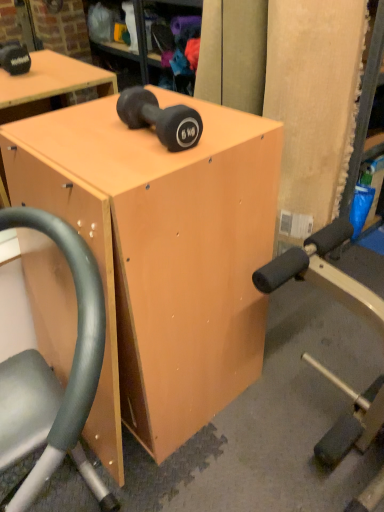
Question: Should I look upward or downward to see matte wood table at center?

Choices:
 (A) up
 (B) down

Answer: (B)

Question: From a real-world perspective, is matte black dumbbell at center physically above matte wood table at center?

Choices:
 (A) yes
 (B) no

Answer: (A)

Question: Considering the relative sizes of matte black dumbbell at center and matte wood table at center in the image provided, is matte black dumbbell at center wider than matte wood table at center?

Choices:
 (A) no
 (B) yes

Answer: (A)

Question: From the image's perspective, is matte black dumbbell at center below matte wood table at center?

Choices:
 (A) yes
 (B) no

Answer: (B)

Question: From the image's perspective, is matte black dumbbell at center on matte wood table at center?

Choices:
 (A) no
 (B) yes

Answer: (B)

Question: Considering the relative sizes of matte black dumbbell at center and matte wood table at center in the image provided, is matte black dumbbell at center smaller than matte wood table at center?

Choices:
 (A) yes
 (B) no

Answer: (A)

Question: Is matte black dumbbell at center to the left of matte wood table at center from the viewer's perspective?

Choices:
 (A) no
 (B) yes

Answer: (A)

Question: Is matte wood table at center closer to camera compared to matte black dumbbell at center?

Choices:
 (A) yes
 (B) no

Answer: (A)

Question: Is matte wood table at center outside matte black dumbbell at center?

Choices:
 (A) yes
 (B) no

Answer: (A)

Question: Considering the relative positions of matte wood table at center and matte black dumbbell at center in the image provided, is matte wood table at center to the right of matte black dumbbell at center from the viewer's perspective?

Choices:
 (A) yes
 (B) no

Answer: (B)

Question: Can you confirm if matte wood table at center is smaller than matte black dumbbell at center?

Choices:
 (A) yes
 (B) no

Answer: (B)

Question: Is matte wood table at center further to the viewer compared to matte black dumbbell at center?

Choices:
 (A) yes
 (B) no

Answer: (B)

Question: Can you confirm if matte wood table at center is wider than matte black dumbbell at center?

Choices:
 (A) no
 (B) yes

Answer: (B)

Question: From a real-world perspective, is matte wood table at center above or below matte black dumbbell at center?

Choices:
 (A) below
 (B) above

Answer: (A)